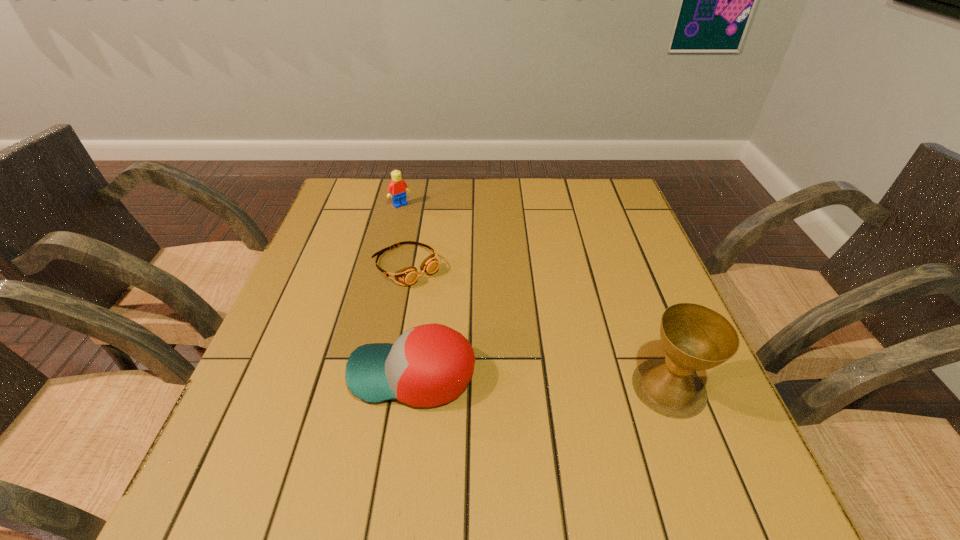
You are a GUI agent. You are given a task and a screenshot of the screen. Output one action in this format:
    pyautogui.click(x=<x>, y=<y>)
    Task: Click on the free spot that satisfies the following two spatial constraints: 1. on the front side of the Lego; 2. on the left side of the chalice
    The width and height of the screenshot is (960, 540).
    Given the screenshot: What is the action you would take?
    pyautogui.click(x=355, y=387)

Find the location of a particular element. blank space that satisfies the following two spatial constraints: 1. on the front side of the Lego; 2. on the right side of the third nearest object is located at coordinates (385, 266).